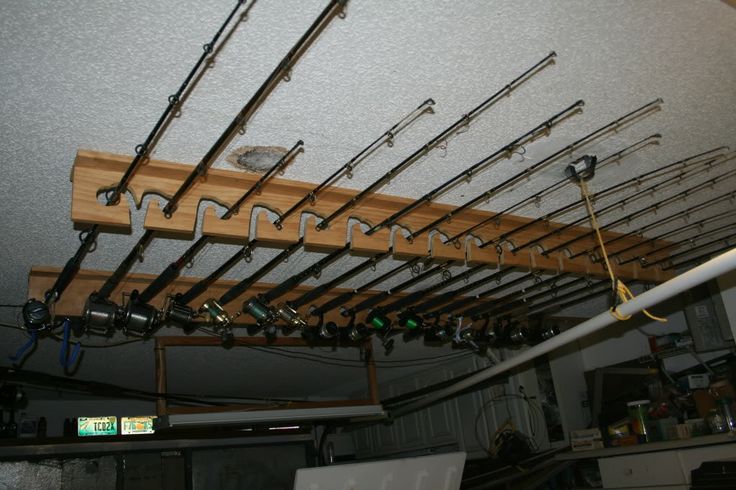
This screenshot has width=736, height=490. In order to click on mantel in this screenshot , I will do (651, 466).